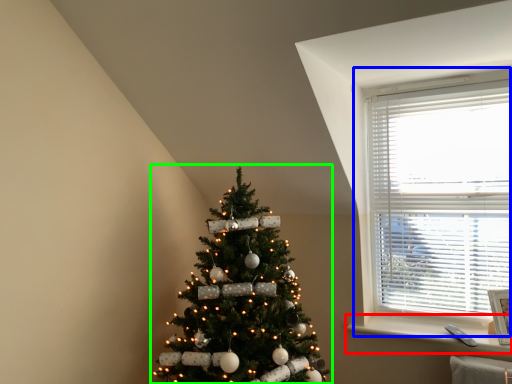
Question: Estimate the real-world distances between objects in this image. Which object is farther from window sill (highlighted by a red box), window (highlighted by a blue box) or christmas tree (highlighted by a green box)?

Choices:
 (A) window
 (B) christmas tree

Answer: (B)